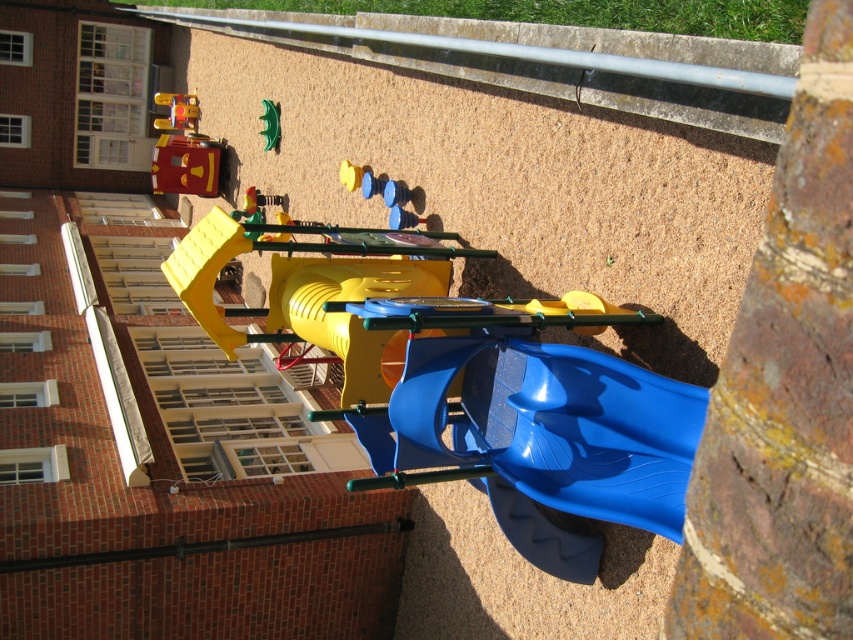
Question: Is metallic yellow fire truck at upper left above green rubber toy at center?

Choices:
 (A) no
 (B) yes

Answer: (B)

Question: Which point is farther from the camera taking this photo?

Choices:
 (A) (187, 104)
 (B) (265, 141)
 (C) (196, 138)

Answer: (A)

Question: Does metallic red toy truck at upper left come in front of metallic yellow fire truck at upper left?

Choices:
 (A) yes
 (B) no

Answer: (A)

Question: Which point appears farthest from the camera in this image?

Choices:
 (A) (196, 148)
 (B) (271, 147)

Answer: (A)

Question: Which point is farther to the camera?

Choices:
 (A) (194, 106)
 (B) (194, 104)
 (C) (267, 122)

Answer: (B)

Question: Does metallic red toy truck at upper left have a greater width compared to metallic yellow fire truck at upper left?

Choices:
 (A) yes
 (B) no

Answer: (A)